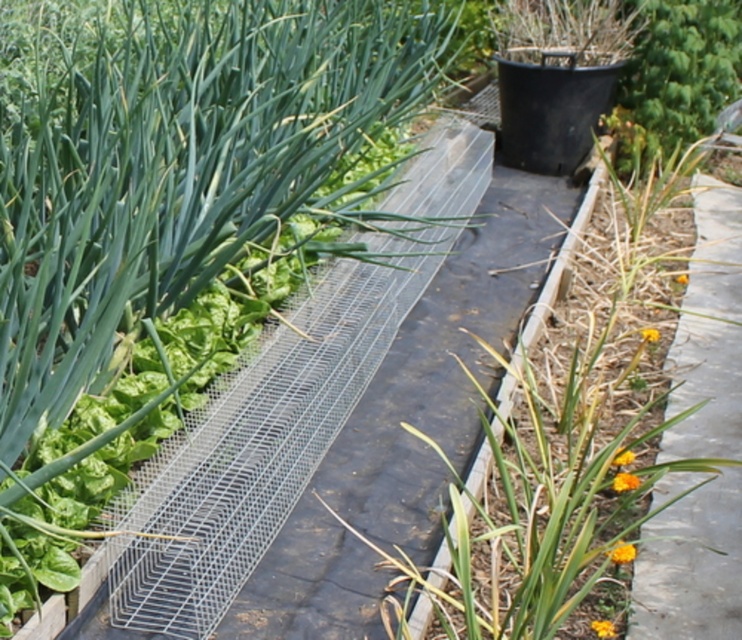
Between point (565, 390) and point (697, 323), which one is positioned behind?

Point (697, 323)

Who is positioned more to the left, green leafy at center or smooth concrete path at right?

green leafy at center is more to the left.

This screenshot has width=742, height=640. What do you see at coordinates (562, 456) in the screenshot?
I see `green leafy at center` at bounding box center [562, 456].

Image resolution: width=742 pixels, height=640 pixels. I want to click on green leafy at center, so click(562, 456).